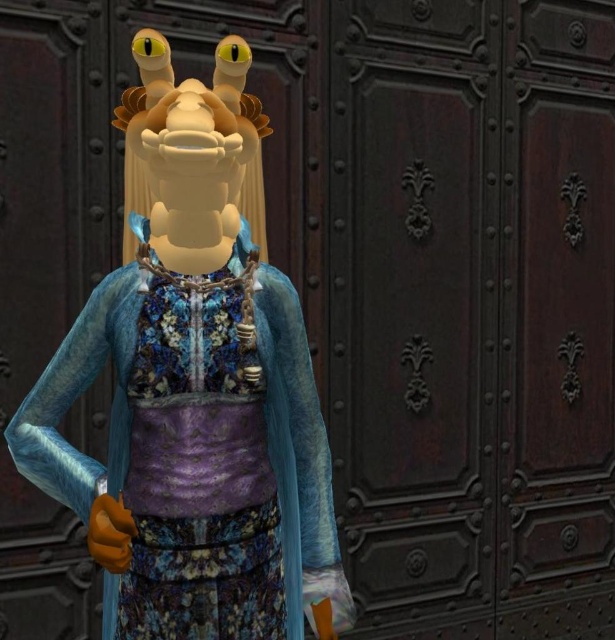
Is point (234, 332) closer to viewer compared to point (130, 442)?

Yes, it is.

Is matte blue fabric doll at center to the right of velvet purple dress at center from the viewer's perspective?

Incorrect, matte blue fabric doll at center is not on the right side of velvet purple dress at center.

Between point (215, 115) and point (213, 413), which one is positioned behind?

The point (213, 413) is more distant.

You are a GUI agent. You are given a task and a screenshot of the screen. Output one action in this format:
    pyautogui.click(x=<x>, y=<y>)
    Task: Click on the matte blue fabric doll at center
    Image resolution: width=615 pixels, height=640 pixels.
    Given the screenshot: What is the action you would take?
    pyautogui.click(x=196, y=394)